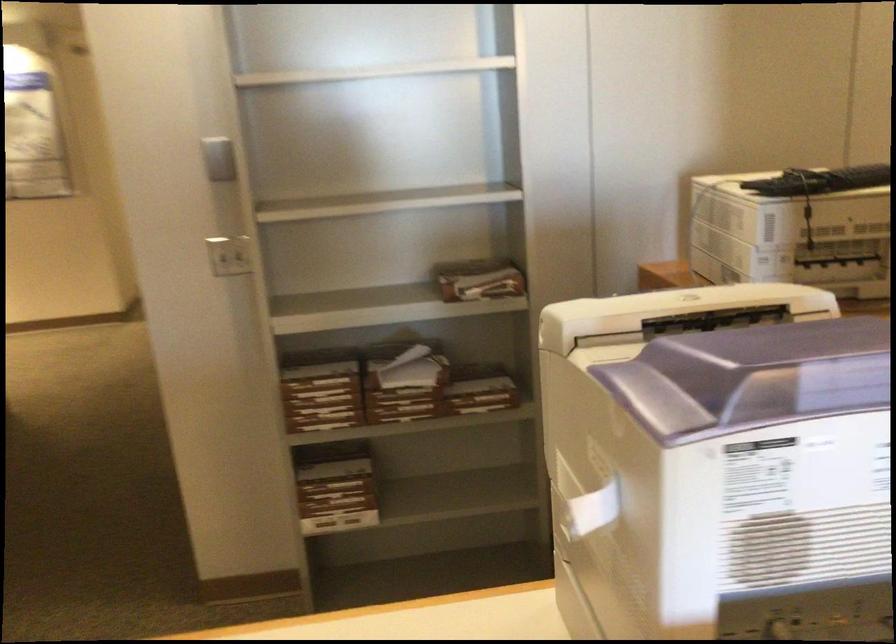
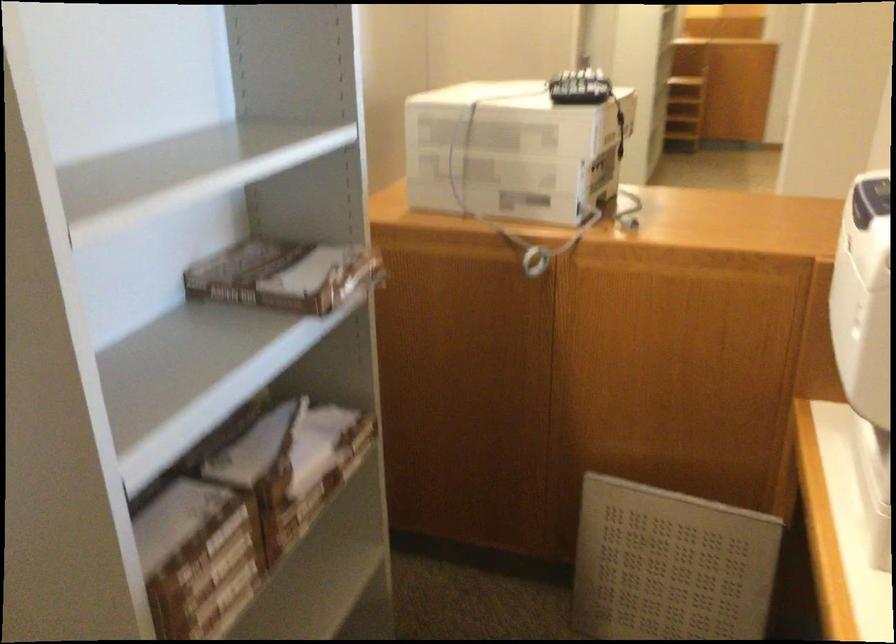
The point at (314, 388) is marked in the first image. Where is the corresponding point in the second image?

(209, 556)